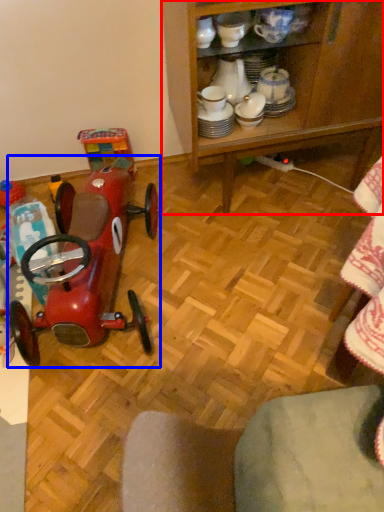
Question: Among these objects, which one is farthest to the camera, cabinetry (highlighted by a red box) or toy (highlighted by a blue box)?

Choices:
 (A) cabinetry
 (B) toy

Answer: (A)